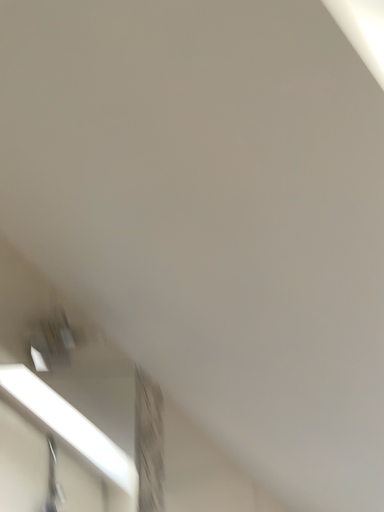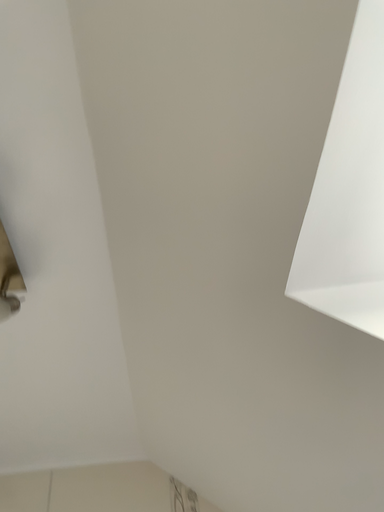
Question: Which way did the camera rotate in the video?

Choices:
 (A) rotated right
 (B) rotated left

Answer: (B)